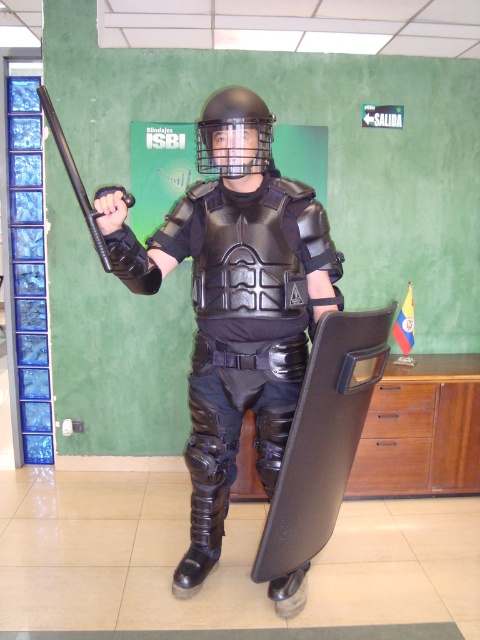
You are a security officer assessing the positioning of two points on a riot shield. The points are labeled as point [229,118] and point [103,237]. Which point is closer to your eyes?

Point [229,118] is further to the viewer than point [103,237], so the point closer to your eyes is point [103,237].

Based on the photo, you are a security officer assessing the positioning of equipment in the scene. The scene shows a person holding a black rubber baton at left and wearing a matte black helmet at center. From the perspective of the person holding them, which object is positioned higher?

The matte black helmet at center is positioned higher than the black rubber baton at left, as it is located above it.

You are a safety inspector evaluating the positioning of the equipment in the scene. The matte black armor at center must be placed at least 6 feet away from the viewer for safety regulations. Is the current placement compliant with the safety standards?

The matte black armor at center is 5.45 feet away from the viewer, which is less than the required 6 feet. Therefore, the current placement does not comply with safety standards.